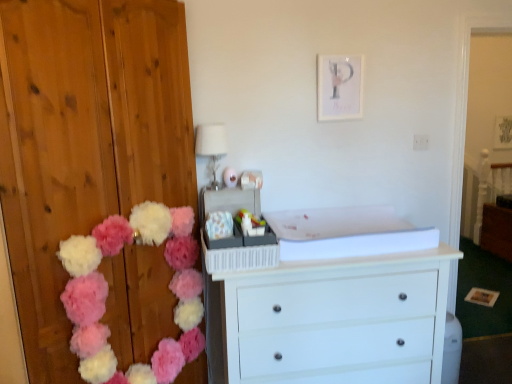
The image size is (512, 384). What are the coordinates of `fluffy fabric pom-poms at left` in the screenshot? It's located at (106, 293).

Where is `brown wood cabinet at right`? Image resolution: width=512 pixels, height=384 pixels. brown wood cabinet at right is located at coordinates (497, 230).

Does white glass lampshade at upper center touch white glossy dresser at center?

No, white glass lampshade at upper center is not with white glossy dresser at center.

Does white glass lampshade at upper center have a lesser height compared to white glossy dresser at center?

Indeed, white glass lampshade at upper center has a lesser height compared to white glossy dresser at center.

You are a GUI agent. You are given a task and a screenshot of the screen. Output one action in this format:
    pyautogui.click(x=<x>, y=<y>)
    Task: Click on the lamp above the white glossy dresser at center (from a real-world perspective)
    The height and width of the screenshot is (384, 512).
    Given the screenshot: What is the action you would take?
    pyautogui.click(x=211, y=146)

Is fluffy fabric pom-poms at left spatially inside white painted wood chest of drawers at center, or outside of it?

The correct answer is: outside.

Is point (116, 234) farther from camera compared to point (341, 357)?

No, (116, 234) is in front of (341, 357).

From a real-world perspective, is fluffy fabric pom-poms at left positioned under white painted wood chest of drawers at center based on gravity?

No, from a real-world perspective, fluffy fabric pom-poms at left is not beneath white painted wood chest of drawers at center.

Which object is further away from the camera, white glossy dresser at center or white glass lampshade at upper center?

white glass lampshade at upper center.

Is white glossy dresser at center not within white glass lampshade at upper center?

That's correct, white glossy dresser at center is outside of white glass lampshade at upper center.

Who is taller, white glossy dresser at center or white glass lampshade at upper center?

white glossy dresser at center.

In terms of width, does white glossy dresser at center look wider or thinner when compared to white glass lampshade at upper center?

Considering their sizes, white glossy dresser at center looks broader than white glass lampshade at upper center.

The image size is (512, 384). I want to click on cabinetry located on the right of fluffy fabric pom-poms at left, so click(497, 230).

Can you tell me how much brown wood cabinet at right and fluffy fabric pom-poms at left differ in facing direction?

The angular difference between brown wood cabinet at right and fluffy fabric pom-poms at left is 129 degrees.

Is brown wood cabinet at right to the left of fluffy fabric pom-poms at left from the viewer's perspective?

Incorrect, brown wood cabinet at right is not on the left side of fluffy fabric pom-poms at left.

Can you confirm if brown wood cabinet at right is smaller than fluffy fabric pom-poms at left?

Incorrect, brown wood cabinet at right is not smaller in size than fluffy fabric pom-poms at left.

Is white glossy dresser at center inside or outside of fluffy fabric pom-poms at left?

white glossy dresser at center is located beyond the bounds of fluffy fabric pom-poms at left.

Is white glossy dresser at center not near fluffy fabric pom-poms at left?

No, there isn't a large distance between white glossy dresser at center and fluffy fabric pom-poms at left.

How far apart are white glossy dresser at center and fluffy fabric pom-poms at left?

white glossy dresser at center is 24.56 centimeters from fluffy fabric pom-poms at left.

This screenshot has width=512, height=384. What are the coordinates of `dresser in front of the fluffy fabric pom-poms at left` in the screenshot? It's located at (85, 141).

Is fluffy fabric pom-poms at left oriented towards brown wood cabinet at right?

Answer: No, fluffy fabric pom-poms at left is not oriented towards brown wood cabinet at right.

How far apart are fluffy fabric pom-poms at left and brown wood cabinet at right?

fluffy fabric pom-poms at left and brown wood cabinet at right are 12.22 feet apart.

Does fluffy fabric pom-poms at left have a greater height compared to brown wood cabinet at right?

Correct, fluffy fabric pom-poms at left is much taller as brown wood cabinet at right.

From the picture: Which of these two, fluffy fabric pom-poms at left or brown wood cabinet at right, is wider?

With larger width is brown wood cabinet at right.

Choose the correct answer: Is white painted wood chest of drawers at center inside white glass lampshade at upper center or outside it?

The correct answer is: outside.

Based on the photo, is white painted wood chest of drawers at center in contact with white glass lampshade at upper center?

No, white painted wood chest of drawers at center is not making contact with white glass lampshade at upper center.

Is white painted wood chest of drawers at center to the left or to the right of white glass lampshade at upper center in the image?

white painted wood chest of drawers at center is positioned on white glass lampshade at upper center's right side.

Is white glass lampshade at upper center at the back of white painted wood chest of drawers at center?

No, white glass lampshade at upper center is not at the back of white painted wood chest of drawers at center.

Identify the location of dresser in front of the white glass lampshade at upper center. The height and width of the screenshot is (384, 512). (85, 141).

Locate an element on the screen. floral arrangement above the white painted wood chest of drawers at center (from the image's perspective) is located at coordinates (106, 293).

From the image, which object appears to be nearer to white painted wood chest of drawers at center, fluffy fabric pom-poms at left or white glass lampshade at upper center?

Based on the image, fluffy fabric pom-poms at left appears to be nearer to white painted wood chest of drawers at center.

When comparing their distances from white glass lampshade at upper center, does brown wood cabinet at right or white glossy dresser at center seem further?

Among the two, brown wood cabinet at right is located further to white glass lampshade at upper center.

When comparing their distances from fluffy fabric pom-poms at left, does white glass lampshade at upper center or brown wood cabinet at right seem further?

brown wood cabinet at right is further to fluffy fabric pom-poms at left.

In the scene shown: Estimate the real-world distances between objects in this image. Which object is further from white painted wood chest of drawers at center, fluffy fabric pom-poms at left or white glossy dresser at center?

white glossy dresser at center lies further to white painted wood chest of drawers at center than the other object.

From the image, which object appears to be nearer to white glass lampshade at upper center, white painted wood chest of drawers at center or fluffy fabric pom-poms at left?

Based on the image, fluffy fabric pom-poms at left appears to be nearer to white glass lampshade at upper center.

Estimate the real-world distances between objects in this image. Which object is closer to white painted wood chest of drawers at center, fluffy fabric pom-poms at left or brown wood cabinet at right?

fluffy fabric pom-poms at left.

Looking at this image, based on their spatial positions, is white glossy dresser at center or white glass lampshade at upper center closer to fluffy fabric pom-poms at left?

white glossy dresser at center is closer to fluffy fabric pom-poms at left.

From the picture: Considering their positions, is white painted wood chest of drawers at center positioned closer to white glossy dresser at center than fluffy fabric pom-poms at left?

fluffy fabric pom-poms at left is positioned closer to the anchor white glossy dresser at center.

Locate an element on the screen. This screenshot has height=384, width=512. floral arrangement between white glossy dresser at center and white painted wood chest of drawers at center is located at coordinates (106, 293).

This screenshot has height=384, width=512. What are the coordinates of `floral arrangement between white glass lampshade at upper center and white painted wood chest of drawers at center in the up-down direction` in the screenshot? It's located at pyautogui.click(x=106, y=293).

Identify the location of lamp between fluffy fabric pom-poms at left and brown wood cabinet at right in the horizontal direction. (211, 146).

The height and width of the screenshot is (384, 512). In order to click on the chest of drawers located between fluffy fabric pom-poms at left and brown wood cabinet at right in the left-right direction in this screenshot , I will do `click(333, 320)`.